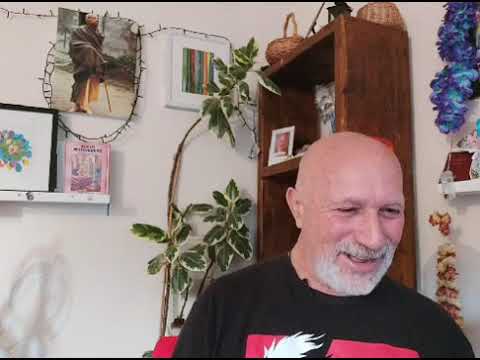
This screenshot has width=480, height=360. I want to click on plant, so click(174, 181).